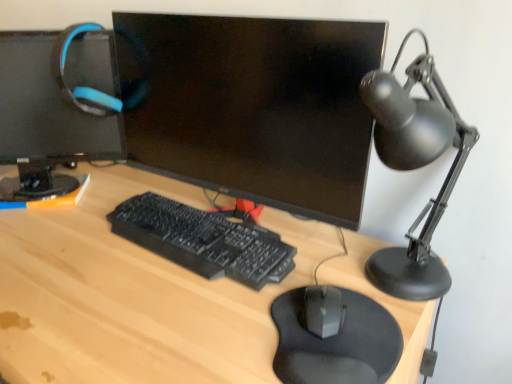
Find the location of `blank space above light wood desk at center (from a real-world perspective)`. blank space above light wood desk at center (from a real-world perspective) is located at coordinates (173, 270).